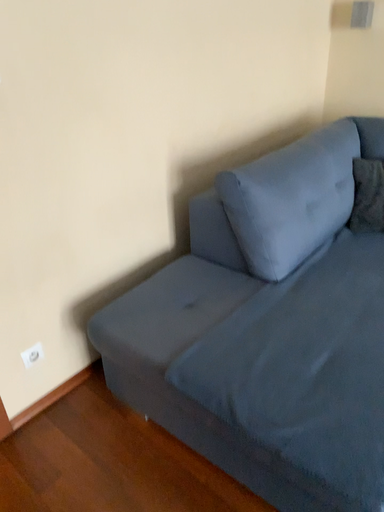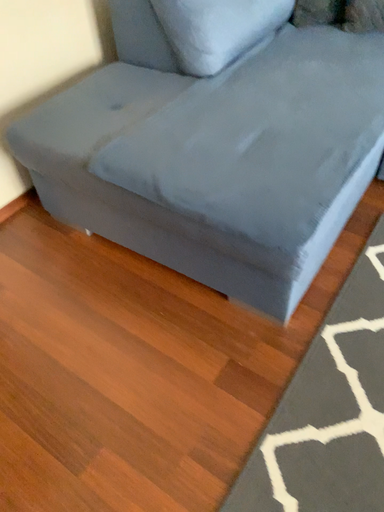
Question: How did the camera likely rotate when shooting the video?

Choices:
 (A) rotated upward
 (B) rotated downward

Answer: (B)